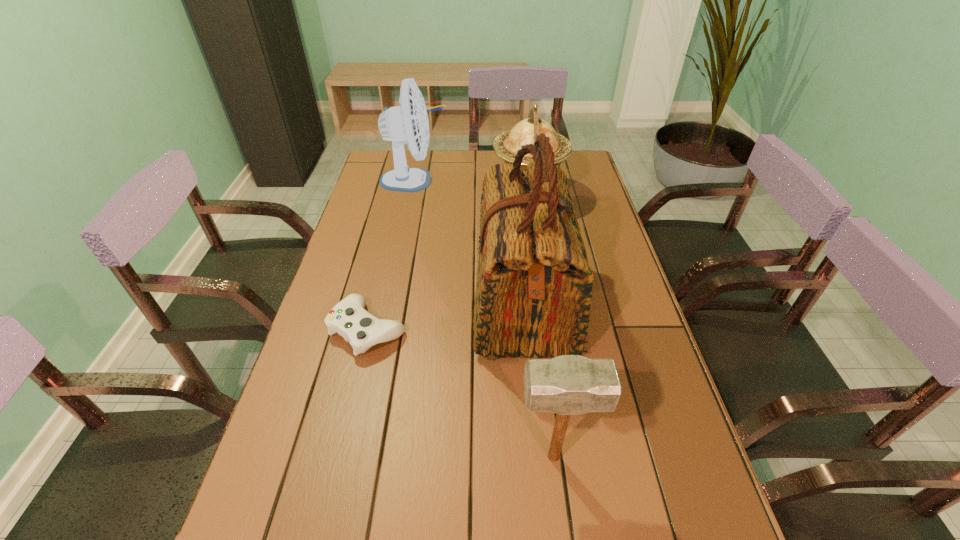
Image resolution: width=960 pixels, height=540 pixels. In order to click on free space located on the front-facing side of the globe in this screenshot , I will do `click(400, 194)`.

Identify the location of vacant area situated 0.130m on the front-facing side of the globe. (456, 194).

The height and width of the screenshot is (540, 960). I want to click on vacant space situated 0.350m on the striking face of the mallet, so click(342, 457).

The height and width of the screenshot is (540, 960). Identify the location of vacant position located on the striking face of the mallet. (397, 457).

Identify the location of free space located 0.390m on the striking face of the mallet. [x=323, y=457].

Find the location of a particular element. This screenshot has width=960, height=540. vacant space located on the back of the control is located at coordinates (381, 274).

Where is `fan that is at the far edge`? Image resolution: width=960 pixels, height=540 pixels. fan that is at the far edge is located at coordinates (408, 123).

The image size is (960, 540). Find the location of `globe that is at the far edge`. globe that is at the far edge is located at coordinates (506, 145).

Where is `fan that is at the left edge`? The width and height of the screenshot is (960, 540). fan that is at the left edge is located at coordinates (408, 123).

I want to click on control at the left edge, so click(x=348, y=318).